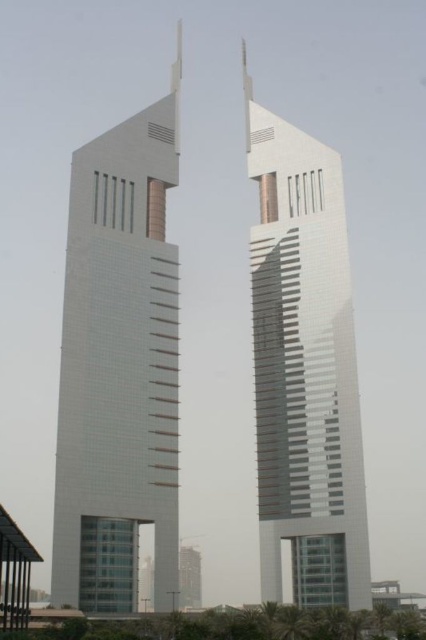
Does white glass tower at center come behind shiny glass tower at center?

No, it is in front of shiny glass tower at center.

Locate an element on the screen. The height and width of the screenshot is (640, 426). white glass tower at center is located at coordinates (118, 365).